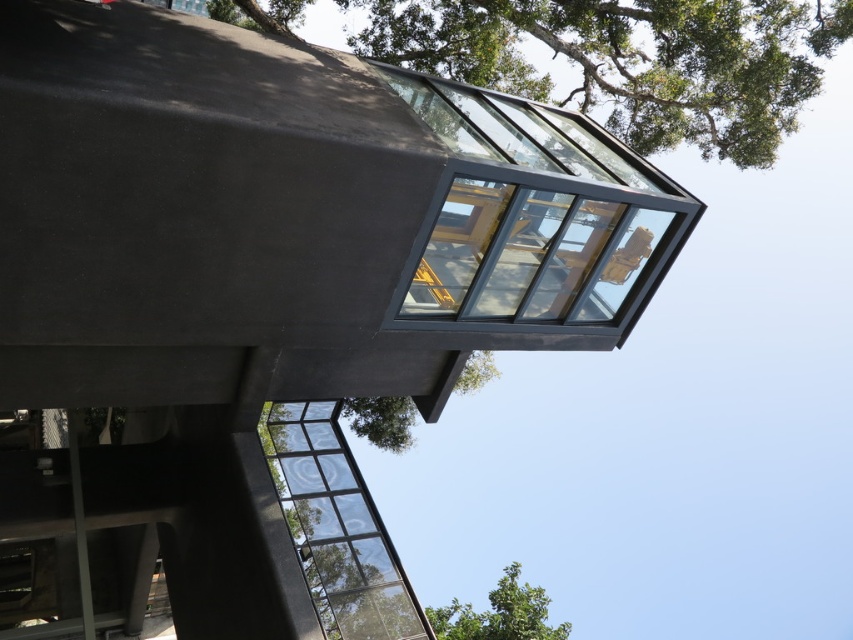
You are standing below the glass structure and looking upwards. You notice two green leafy trees in the upper part of your view. Which of the two trees, the green leafy tree at upper center or the green leafy tree at upper right, appears taller from your perspective?

The green leafy tree at upper center appears taller than the green leafy tree at upper right because it has a greater height compared to the latter according to the description.

From the picture: You are standing directly below the structure and want to take a photo of the green leafy tree at upper center. According to the coordinates provided, where should you aim your camera to capture it?

You should aim your camera at point (631, 60) to capture the green leafy tree at upper center.

You are standing under the glass structure and looking up. There is a point marked at coordinates (631, 60). Based on the scene description, what object is this point located on?

The point at (631, 60) is located on the green leafy tree at upper center.